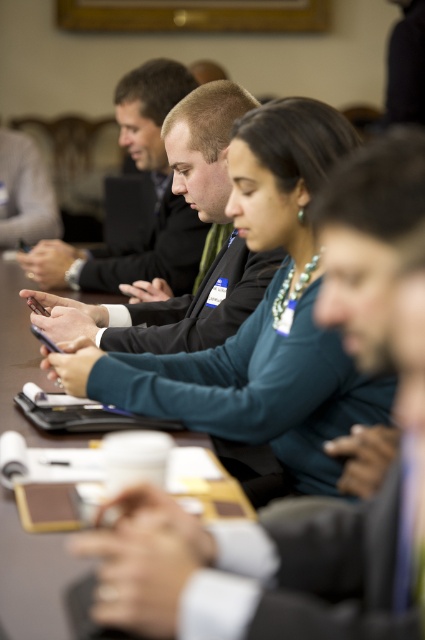
Between teal fabric shirt at center and brown leather table at center, which one has less height?

Standing shorter between the two is brown leather table at center.

Between point (251, 337) and point (67, 632), which one is positioned behind?

Point (251, 337)

Where is `teal fabric shirt at center`? teal fabric shirt at center is located at coordinates (263, 316).

I want to click on matte black suit at center, so click(203, 252).

Between matte black suit at center and brown leather table at center, which one has more height?

matte black suit at center

Looking at this image, who is more forward, (246,307) or (206,442)?

Point (206,442) is in front.

In order to click on matte black suit at center in this screenshot , I will do `click(203, 252)`.

Is point (246, 216) in front of point (90, 337)?

Yes, it is in front of point (90, 337).

Can you confirm if teal fabric shirt at center is positioned above matte black suit at center?

No.

Which is in front, point (289, 365) or point (119, 326)?

Positioned in front is point (289, 365).

This screenshot has width=425, height=640. Find the location of `teal fabric shirt at center`. teal fabric shirt at center is located at coordinates (263, 316).